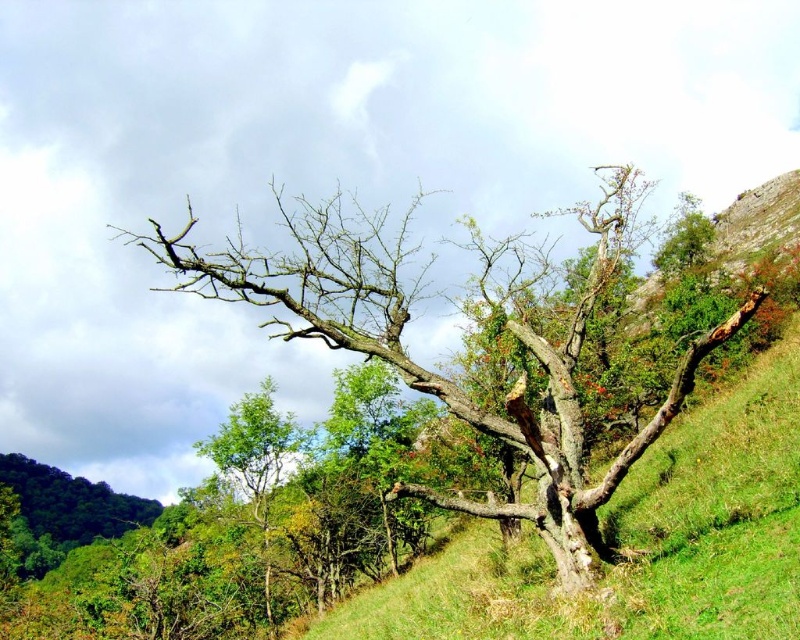
This screenshot has width=800, height=640. Identify the location of green grassy at center. (636, 541).

From the picture: Is barky brown tree at center closer to camera compared to green leafy tree at lower left?

Yes, it is in front of green leafy tree at lower left.

In the scene shown: Can you confirm if barky brown tree at center is positioned above green leafy tree at lower left?

Yes, barky brown tree at center is above green leafy tree at lower left.

Does point (314, 337) come farther from viewer compared to point (264, 381)?

No, (314, 337) is in front of (264, 381).

The width and height of the screenshot is (800, 640). Find the location of `barky brown tree at center`. barky brown tree at center is located at coordinates (441, 376).

Is the position of green grassy at center less distant than that of green leafy tree at lower left?

Yes, green grassy at center is in front of green leafy tree at lower left.

Is green grassy at center above green leafy tree at lower left?

Correct, green grassy at center is located above green leafy tree at lower left.

Is point (770, 356) positioned in front of point (240, 406)?

Yes.

What are the coordinates of `green grassy at center` in the screenshot? It's located at (636, 541).